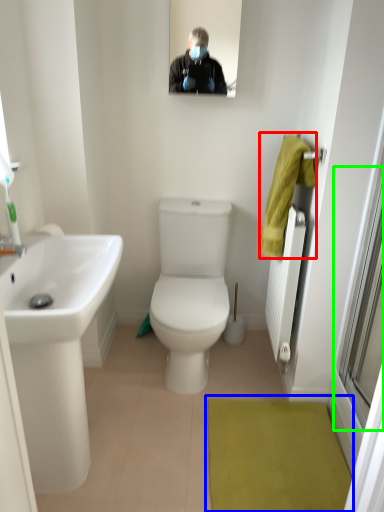
Question: Considering the real-world distances, which object is farthest from hand towel (highlighted by a red box)? bath mat (highlighted by a blue box) or window screen (highlighted by a green box)?

Choices:
 (A) bath mat
 (B) window screen

Answer: (A)